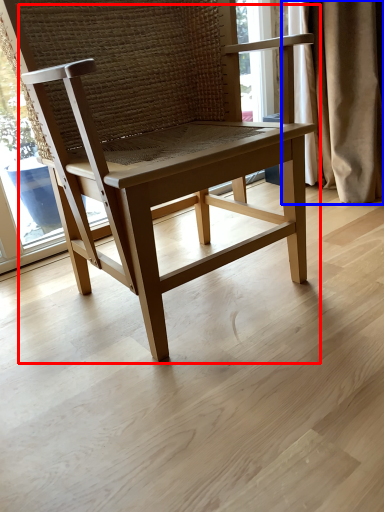
Question: Which of the following is the farthest to the observer, chair (highlighted by a red box) or curtain (highlighted by a blue box)?

Choices:
 (A) chair
 (B) curtain

Answer: (B)